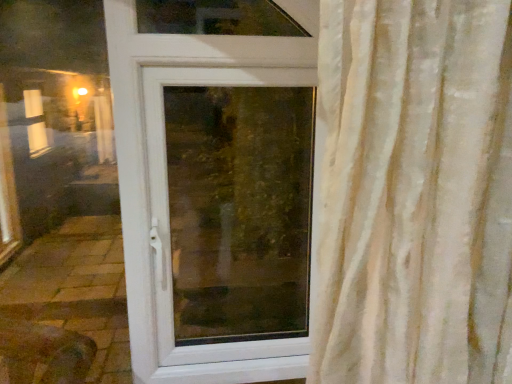
Question: From a real-world perspective, is white plastic door at center physically below transparent glass window at center?

Choices:
 (A) yes
 (B) no

Answer: (B)

Question: Is white plastic door at center located outside transparent glass window at center?

Choices:
 (A) yes
 (B) no

Answer: (B)

Question: From the image's perspective, is white plastic door at center located above transparent glass window at center?

Choices:
 (A) no
 (B) yes

Answer: (B)

Question: Is white plastic door at center behind transparent glass window at center?

Choices:
 (A) no
 (B) yes

Answer: (A)

Question: Is white plastic door at center in front of transparent glass window at center?

Choices:
 (A) yes
 (B) no

Answer: (A)

Question: Is white plastic door at center wider than transparent glass window at center?

Choices:
 (A) no
 (B) yes

Answer: (A)

Question: Is transparent glass window at center not within white plastic door at center?

Choices:
 (A) yes
 (B) no

Answer: (B)

Question: Can you confirm if transparent glass window at center is bigger than white plastic door at center?

Choices:
 (A) no
 (B) yes

Answer: (A)

Question: Could you tell me if transparent glass window at center is facing white plastic door at center?

Choices:
 (A) no
 (B) yes

Answer: (B)

Question: From a real-world perspective, is transparent glass window at center under white plastic door at center?

Choices:
 (A) no
 (B) yes

Answer: (B)

Question: Is transparent glass window at center with white plastic door at center?

Choices:
 (A) no
 (B) yes

Answer: (A)

Question: From the image's perspective, does transparent glass window at center appear higher than white plastic door at center?

Choices:
 (A) no
 (B) yes

Answer: (A)

Question: From a real-world perspective, is transparent glass window at center positioned above or below white plastic door at center?

Choices:
 (A) above
 (B) below

Answer: (B)